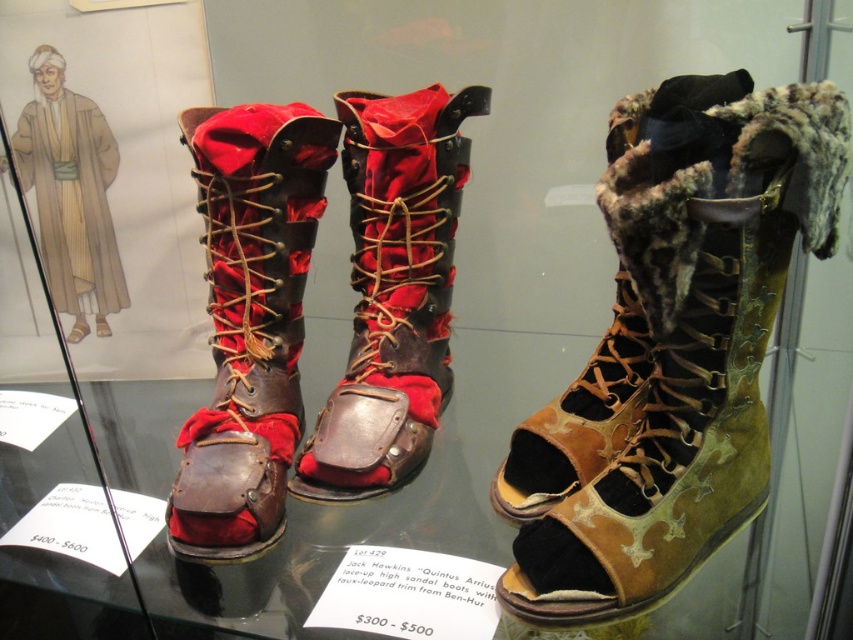
You are a museum curator arranging an exhibit. You need to place a rectangular display card that is 15 cm wide between the brown leather boot at center and the leather with fur trim sandal at right. Can the display card fit between them without overlapping either boot?

The brown leather boot at center is narrower than the leather with fur trim sandal at right. Since the display card is 15 cm wide, it can fit between them as long as the space between the two boots is at least 15 cm. However, the exact placement depends on the distance between the boots, which isn

You are a security guard in the museum and need to ensure that the brown leather boot at center and the leather with fur trim sandal at right are not moved. Which direction should you monitor between them to prevent any tampering?

You should monitor the left side of the leather with fur trim sandal at right because the brown leather boot at center is located to its left, so keeping an eye on that direction will help prevent tampering between them.